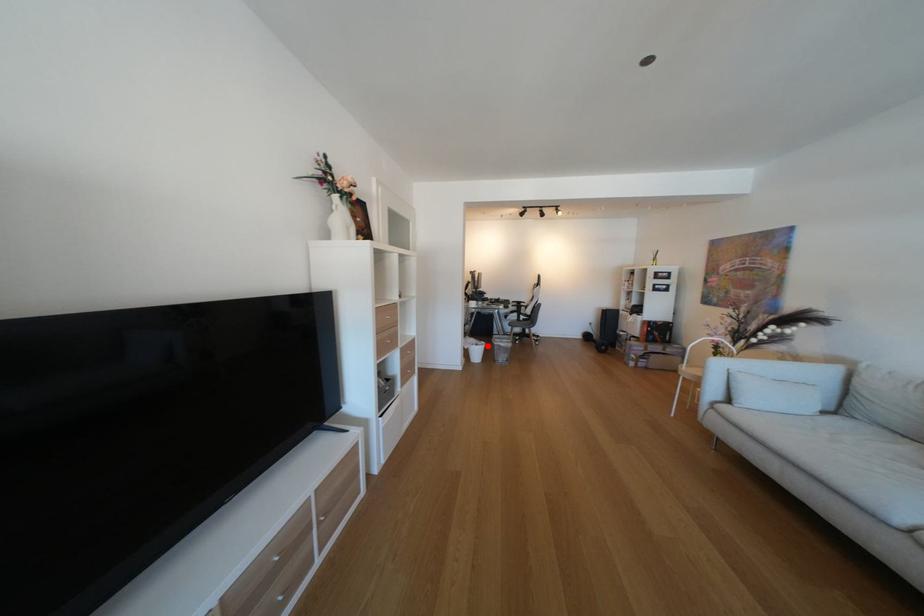
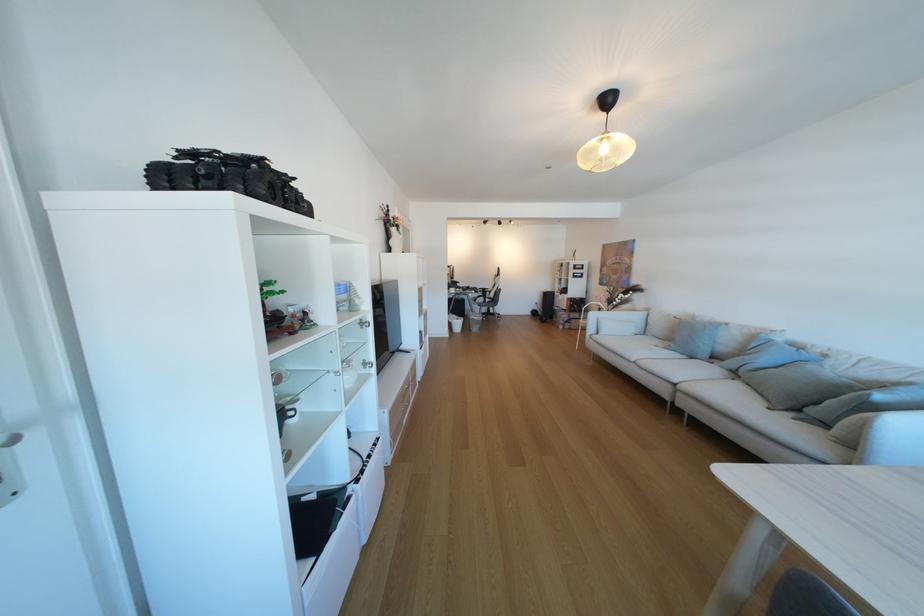
Locate, in the second image, the point that corresponds to the highlighted location in the first image.

(468, 321)